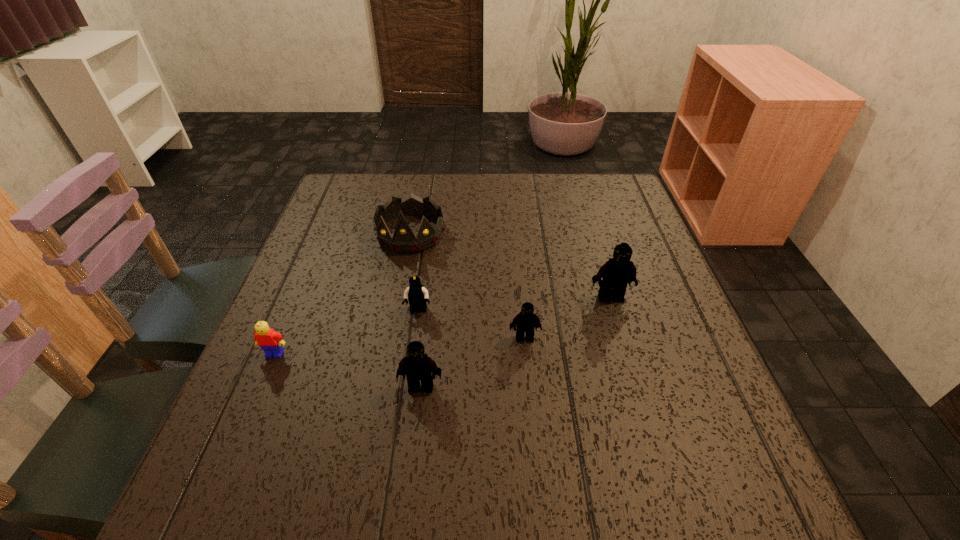
Where is `vacant space at the left edge of the desktop`? vacant space at the left edge of the desktop is located at coordinates (276, 313).

In the image, there is a desktop. At what (x,y) coordinates should I click in order to perform the action: click on vacant area at the right edge. Please return your answer as a coordinate pair (x, y). The height and width of the screenshot is (540, 960). Looking at the image, I should click on (628, 287).

This screenshot has height=540, width=960. Identify the location of vacant region at the near left corner of the desktop. (309, 447).

In the image, there is a desktop. Identify the location of vacant space at the far right corner. The width and height of the screenshot is (960, 540). (620, 181).

This screenshot has width=960, height=540. What are the coordinates of `free space between the second farthest object and the third farthest object` in the screenshot? It's located at (515, 304).

The width and height of the screenshot is (960, 540). What are the coordinates of `vacant area between the fourth farthest object and the nearest Lego` in the screenshot? It's located at (472, 362).

Identify the location of empty space between the fifth object from left to right and the nearest Lego. (472, 362).

Where is `free space between the rightmost Lego and the second farthest Lego`? This screenshot has width=960, height=540. free space between the rightmost Lego and the second farthest Lego is located at coordinates 515,304.

In order to click on vacant point located between the second farthest Lego and the third nearest object in this screenshot , I will do `click(471, 324)`.

Locate an element on the screen. Image resolution: width=960 pixels, height=540 pixels. free space between the rightmost object and the tiara is located at coordinates (511, 265).